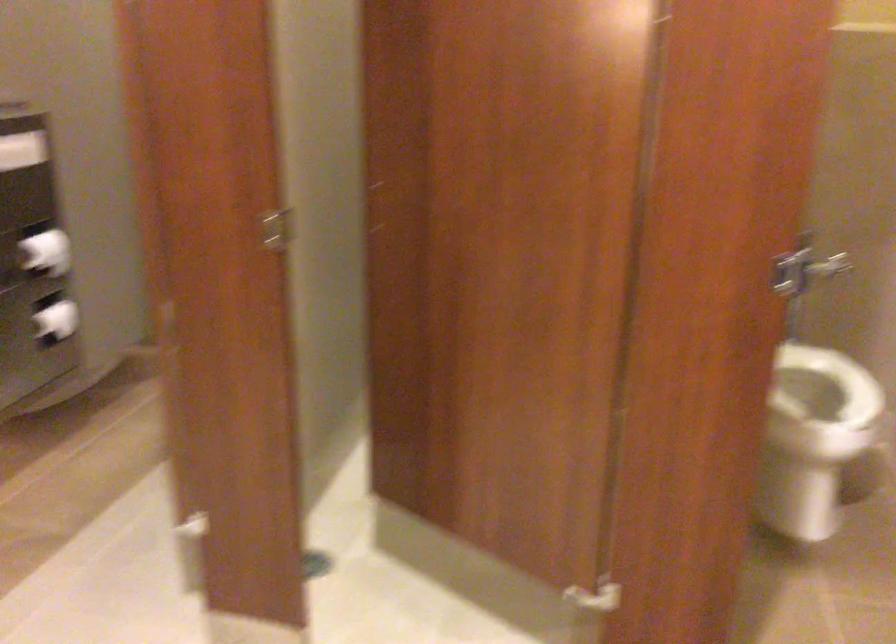
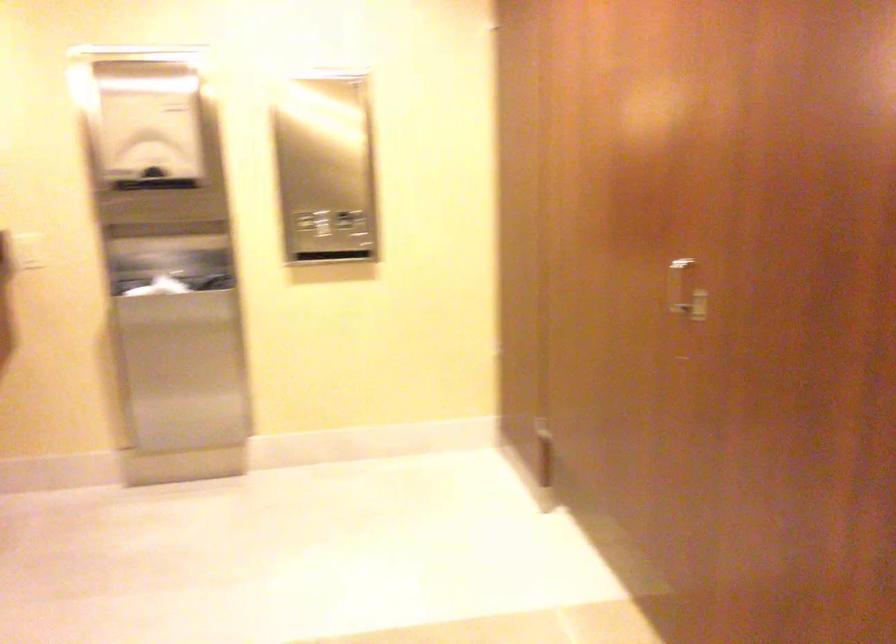
Question: Based on the continuous images, in which direction is the camera rotating? Reply with the corresponding letter.

Choices:
 (A) Left
 (B) Right
 (C) Up
 (D) Down

Answer: (A)